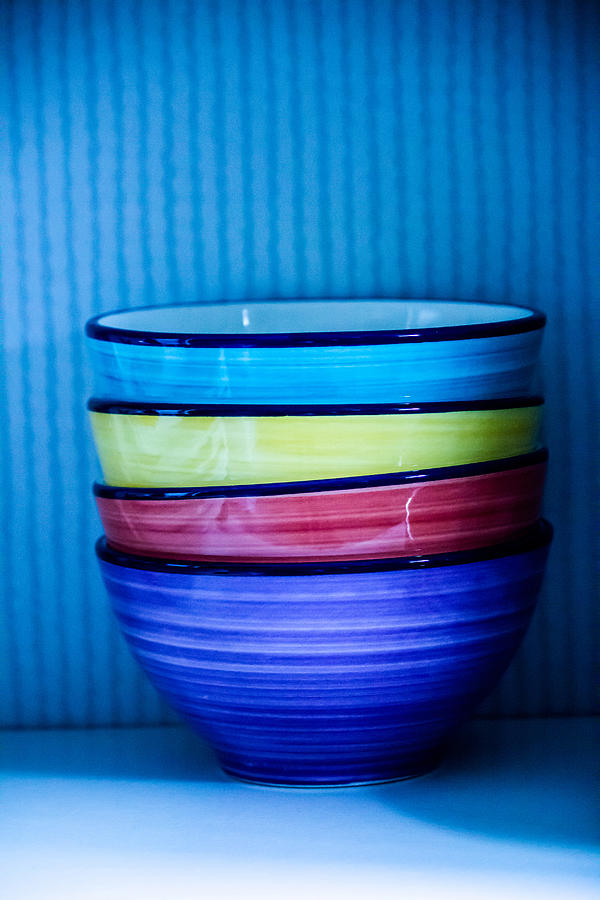
The height and width of the screenshot is (900, 600). Identify the location of stack of bowls. (317, 470).